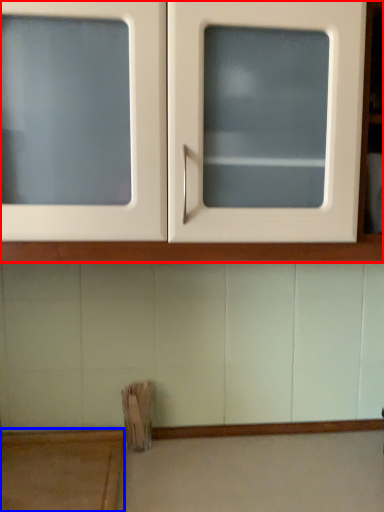
Question: Among these objects, which one is nearest to the camera, cabinetry (highlighted by a red box) or table (highlighted by a blue box)?

Choices:
 (A) cabinetry
 (B) table

Answer: (A)